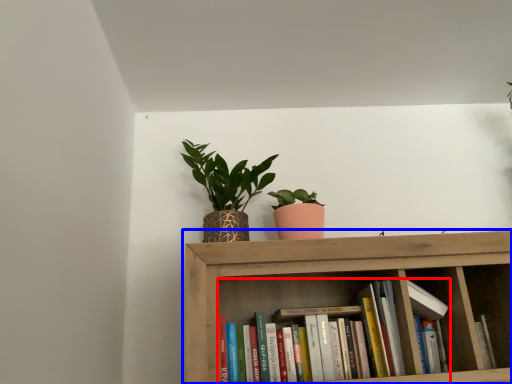
Question: Which of the following is the farthest to the observer, book (highlighted by a red box) or shelf (highlighted by a blue box)?

Choices:
 (A) book
 (B) shelf

Answer: (A)